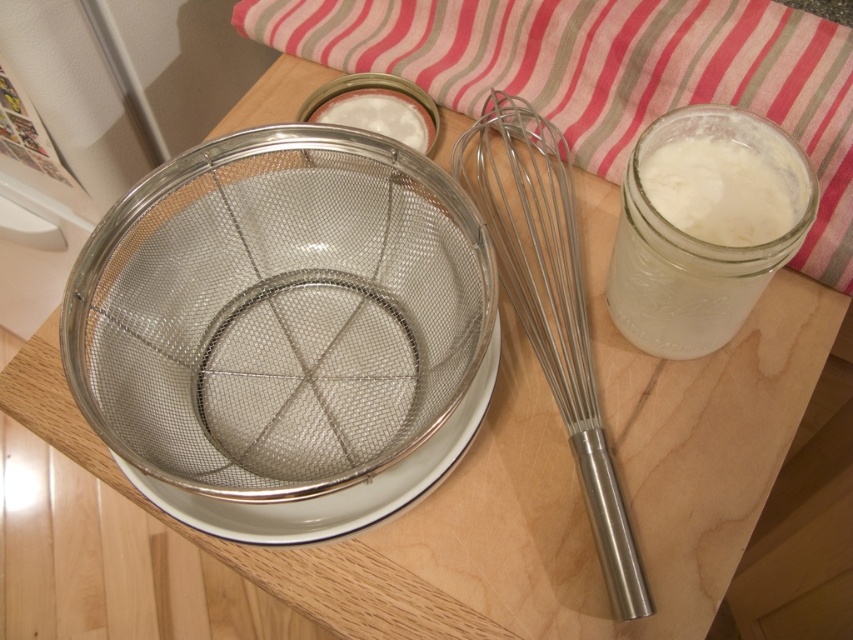
Is metallic mesh strainer at center positioned before metallic silver whisk at center?

Yes, metallic mesh strainer at center is in front of metallic silver whisk at center.

Does metallic mesh strainer at center appear over metallic silver whisk at center?

Actually, metallic mesh strainer at center is below metallic silver whisk at center.

This screenshot has height=640, width=853. I want to click on metallic mesh strainer at center, so click(277, 310).

Is metallic mesh strainer at center thinner than white opaque liquid at right?

No, metallic mesh strainer at center is not thinner than white opaque liquid at right.

Between metallic mesh strainer at center and white opaque liquid at right, which one appears on the right side from the viewer's perspective?

white opaque liquid at right is more to the right.

Which is in front, point (143, 252) or point (761, 282)?

Point (761, 282)

This screenshot has height=640, width=853. I want to click on metallic mesh strainer at center, so click(x=277, y=310).

Can you confirm if metallic silver whisk at center is positioned above white opaque liquid at right?

No.

Between point (526, 216) and point (669, 340), which one is positioned in front?

Point (669, 340) is in front.

The height and width of the screenshot is (640, 853). I want to click on metallic silver whisk at center, so click(550, 305).

Locate an element on the screen. The height and width of the screenshot is (640, 853). metallic silver whisk at center is located at coordinates (550, 305).